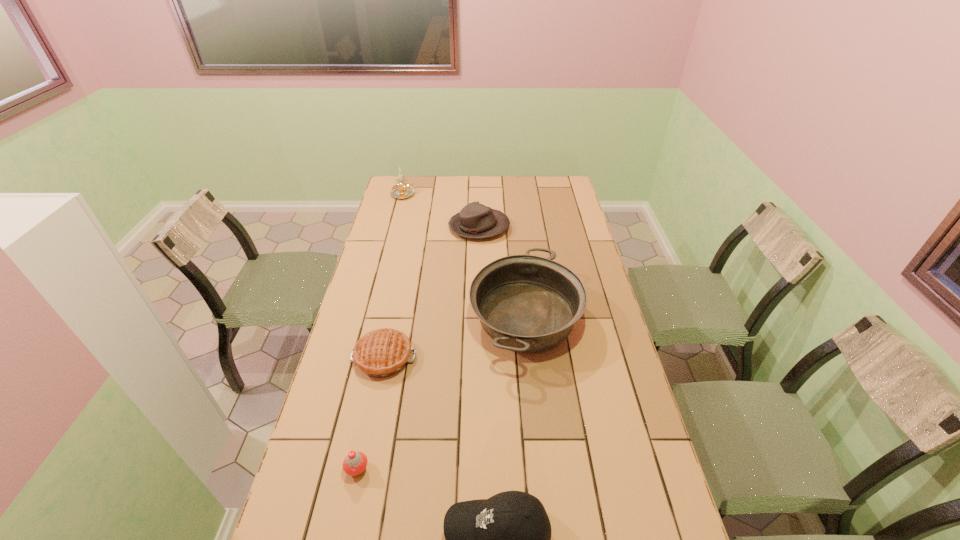
I want to click on object situated at the far edge, so click(403, 190).

Find the location of a particular element. The image size is (960, 540). candle holder that is at the left edge is located at coordinates (403, 190).

The width and height of the screenshot is (960, 540). Find the location of `cupcake that is at the left edge`. cupcake that is at the left edge is located at coordinates (354, 464).

Locate an element on the screen. pie located in the left edge section of the desktop is located at coordinates (381, 353).

Locate an element on the screen. object situated at the right edge is located at coordinates (526, 303).

Where is `object that is at the far left corner`? This screenshot has height=540, width=960. object that is at the far left corner is located at coordinates (403, 190).

This screenshot has width=960, height=540. In order to click on free space at the far edge in this screenshot , I will do `click(462, 190)`.

Where is `vacant space at the left edge`? vacant space at the left edge is located at coordinates (377, 310).

The height and width of the screenshot is (540, 960). I want to click on vacant space at the right edge of the desktop, so click(603, 325).

In the image, there is a desktop. Where is `blank space at the far left corner`? blank space at the far left corner is located at coordinates (401, 199).